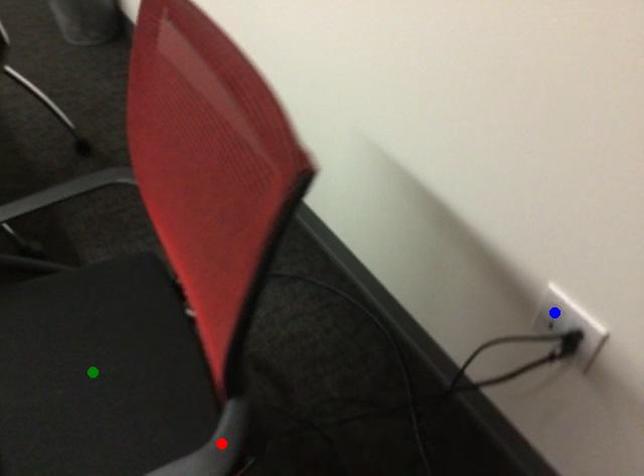
Order these from nearest to farthest:
green point, blue point, red point

red point < green point < blue point